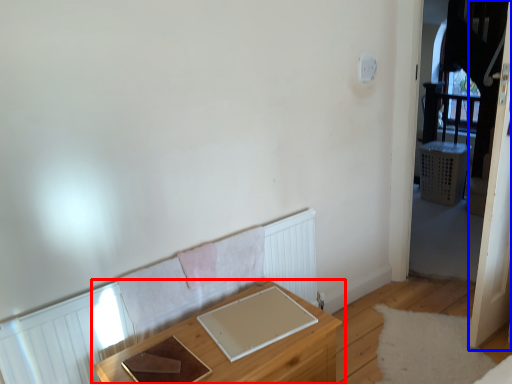
Question: Which of the following is the closest to the observer, table (highlighted by a red box) or screen door (highlighted by a blue box)?

Choices:
 (A) table
 (B) screen door

Answer: (A)